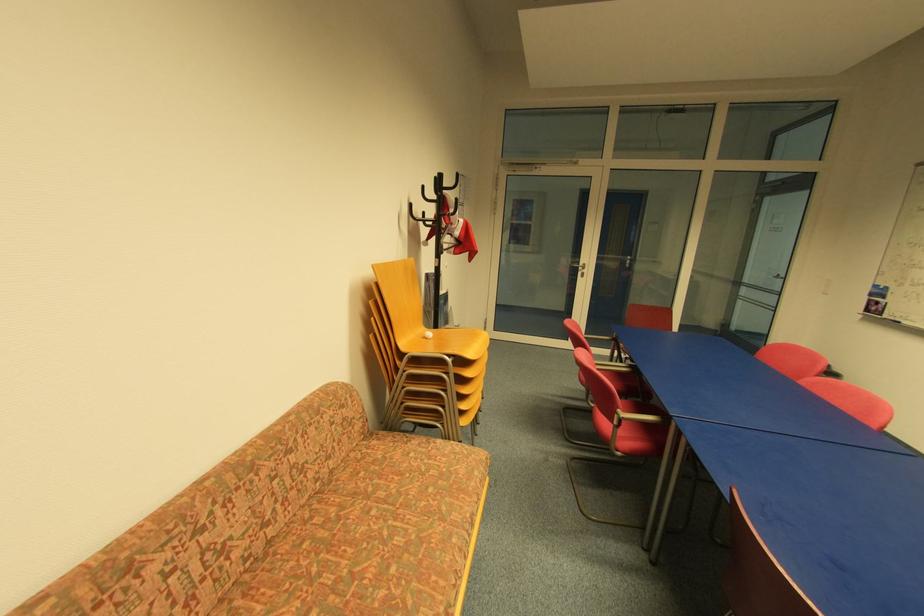
Find where to sit the yellow chair sitting surface. Please return your answer as a coordinate pair (x, y).

(464, 339)